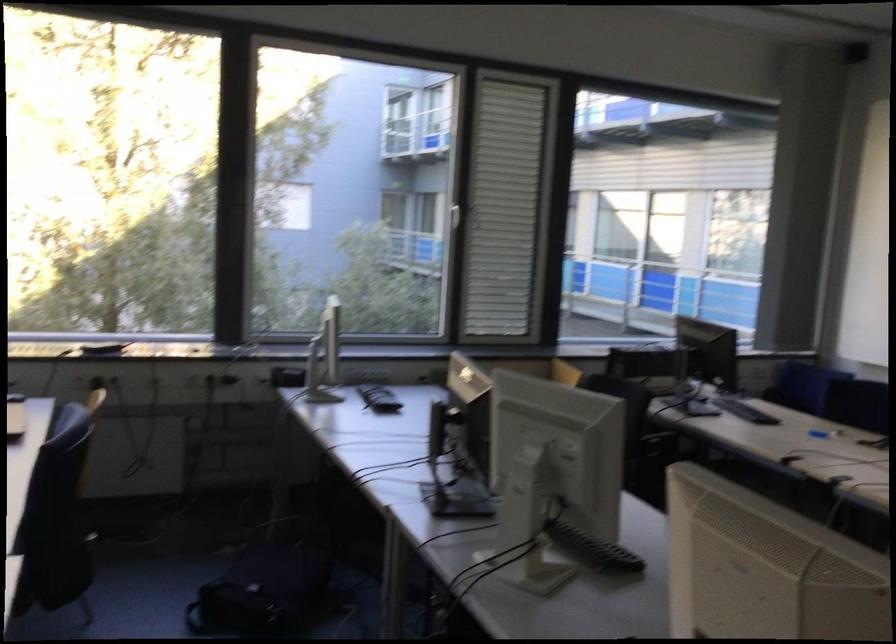
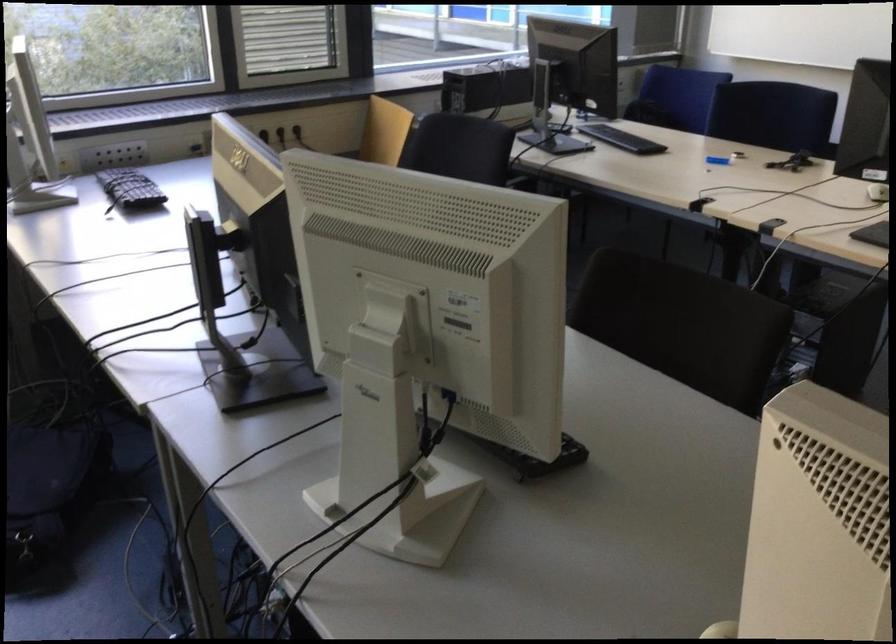
Question: In a continuous first-person perspective shot, in which direction is the camera moving?

Choices:
 (A) Left
 (B) Right
 (C) Forward
 (D) Backward

Answer: (C)